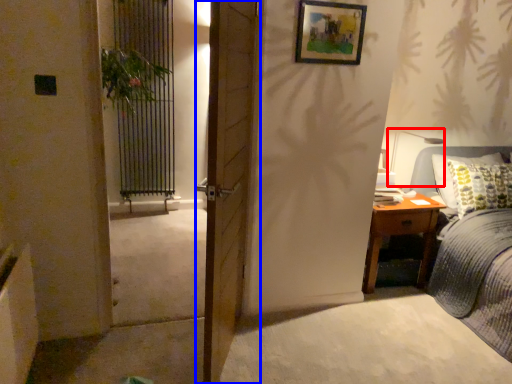
Question: Among these objects, which one is nearest to the camera, table lamp (highlighted by a red box) or door (highlighted by a blue box)?

Choices:
 (A) table lamp
 (B) door

Answer: (B)